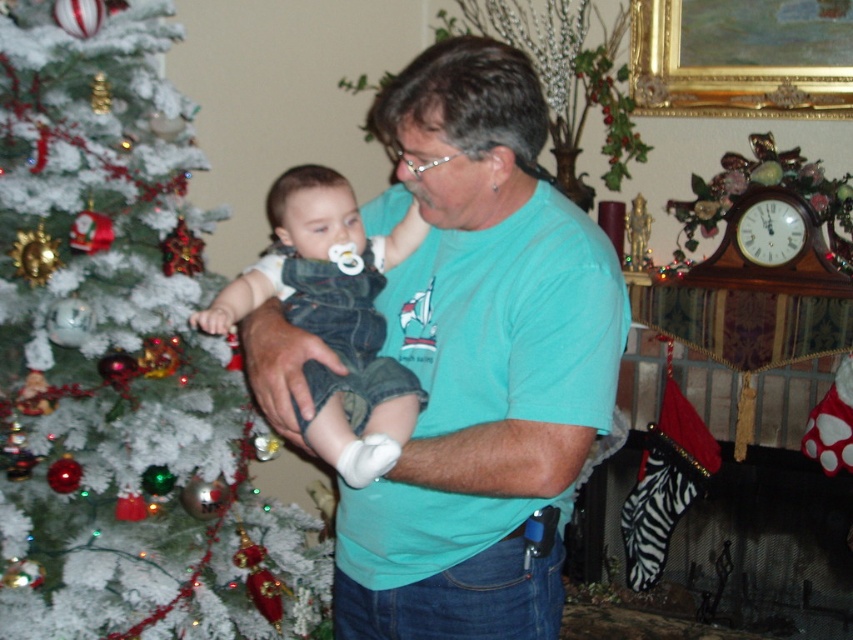
Question: Can you confirm if teal t-shirt at center is positioned to the left of gold ornate picture frame at upper right?

Choices:
 (A) no
 (B) yes

Answer: (B)

Question: Is white frosted tree at left further to camera compared to gold ornate picture frame at upper right?

Choices:
 (A) yes
 (B) no

Answer: (B)

Question: Among these objects, which one is nearest to the camera?

Choices:
 (A) teal t-shirt at center
 (B) gold ornate picture frame at upper right
 (C) denim overalls at center

Answer: (C)

Question: Among these objects, which one is farthest from the camera?

Choices:
 (A) teal t-shirt at center
 (B) gold ornate picture frame at upper right
 (C) denim overalls at center
 (D) white frosted tree at left

Answer: (B)

Question: Which point is farther from the camera taking this photo?

Choices:
 (A) (752, 108)
 (B) (376, 497)

Answer: (A)

Question: Is denim overalls at center above gold ornate picture frame at upper right?

Choices:
 (A) no
 (B) yes

Answer: (A)